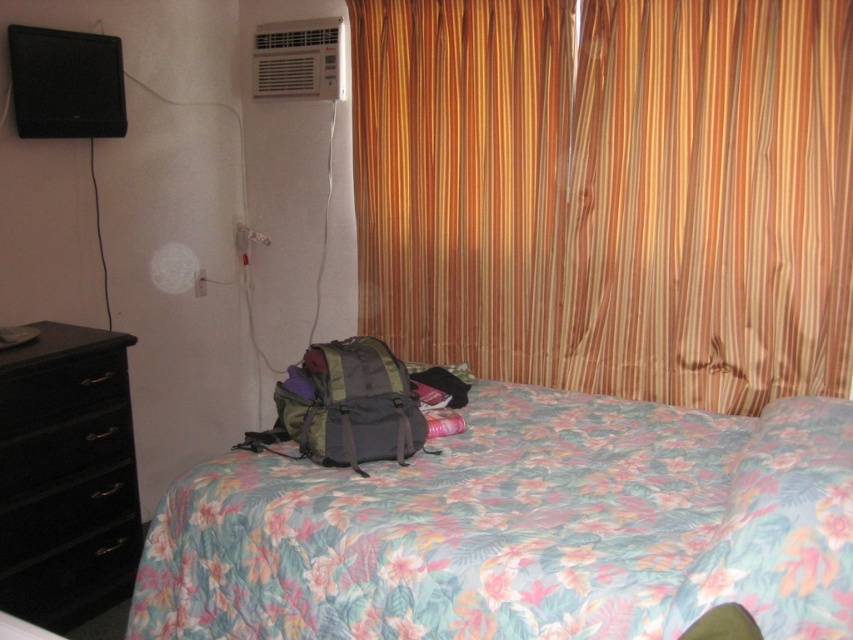
Who is positioned more to the right, wooden striped curtain at center or white plastic air conditioner at upper center?

Positioned to the right is wooden striped curtain at center.

Is wooden striped curtain at center smaller than white plastic air conditioner at upper center?

No.

Find the location of a particular element. wooden striped curtain at center is located at coordinates (610, 193).

At what (x,y) coordinates should I click in order to perform the action: click on wooden striped curtain at center. Please return your answer as a coordinate pair (x, y). Looking at the image, I should click on (610, 193).

Is black glossy drawer at left closer to camera compared to black matte drawer at left?

No.

Can you confirm if black glossy drawer at left is shorter than black matte drawer at left?

Incorrect, black glossy drawer at left's height does not fall short of black matte drawer at left's.

Between point (88, 504) and point (113, 400), which one is positioned behind?

Point (113, 400)

The height and width of the screenshot is (640, 853). What are the coordinates of `black glossy drawer at left` in the screenshot? It's located at (65, 515).

Does wooden striped curtain at center have a lesser height compared to black glossy drawer at lower left?

Incorrect, wooden striped curtain at center's height does not fall short of black glossy drawer at lower left's.

Does wooden striped curtain at center have a greater width compared to black glossy drawer at lower left?

Yes, wooden striped curtain at center is wider than black glossy drawer at lower left.

I want to click on wooden striped curtain at center, so point(610,193).